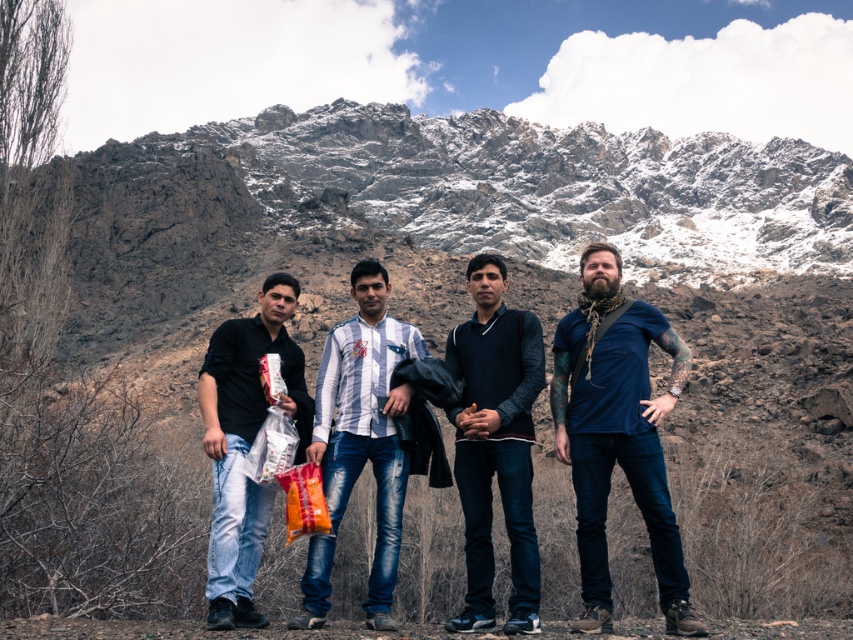
You are a photographer planning to take a group photo of the blue denim jeans at right and the dark blue sweater at center. Based on their positions, which object should you focus on first to ensure both are in frame?

The blue denim jeans at right is located below the dark blue sweater at center, so you should focus on the dark blue sweater at center first to ensure both are in frame.

You are trying to locate the blue denim jeans at right and the dark blue sweater at center in the image. Which of these two items is located to the right of the other?

The blue denim jeans at right is positioned on the right side of dark blue sweater at center.

You are planning to take a photo of the group while ensuring that both the blue denim jeans at right and the matte black shirt at left are clearly visible. Based on their sizes, which object will appear bigger in the photo?

The blue denim jeans at right will appear bigger in the photo because it is larger in size than the matte black shirt at left according to the description.